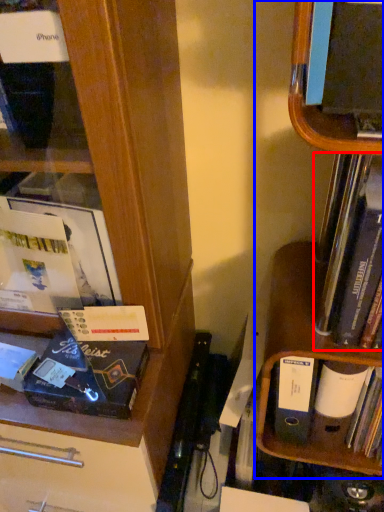
Question: Among these objects, which one is farthest to the camera, book (highlighted by a red box) or shelf (highlighted by a blue box)?

Choices:
 (A) book
 (B) shelf

Answer: (A)